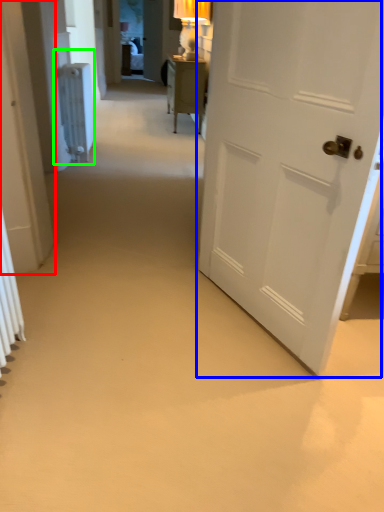
Question: Based on their relative distances, which object is farther from door (highlighted by a red box)? Choose from door (highlighted by a blue box) and radiator (highlighted by a green box).

Choices:
 (A) door
 (B) radiator

Answer: (B)